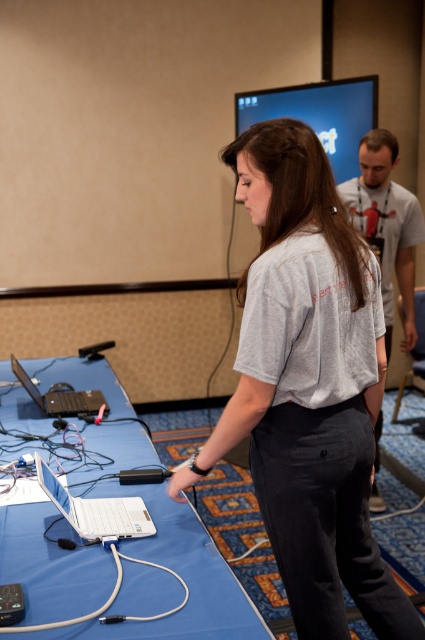
You are setting up for a tech workshop and need to place a white plastic laptop at lower left on a surface. The white plastic table at lower left is available. Based on the scene description, will the laptop fit on the table?

The white plastic table at lower left is much taller than the white plastic laptop at lower left, so the laptop will fit on the table since the table has enough height to accommodate it.